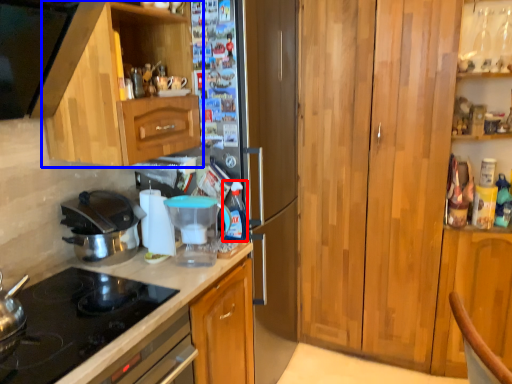
Question: Among these objects, which one is farthest to the camera, bottle (highlighted by a red box) or cabinetry (highlighted by a blue box)?

Choices:
 (A) bottle
 (B) cabinetry

Answer: (A)